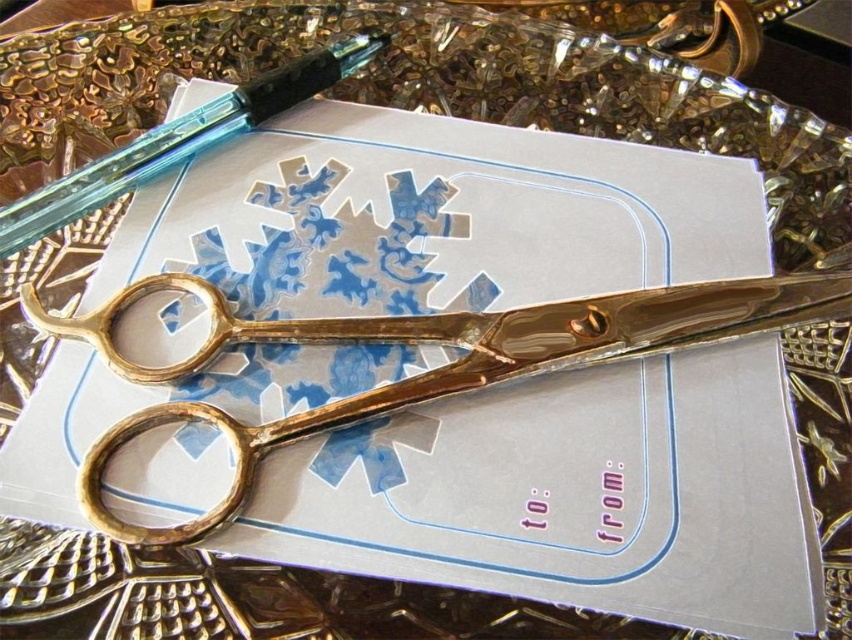
You are designing a display for a craft store and need to arrange the gold polished scissors at center and the translucent blue glass pen at upper left. The scissors are shorter than the pen. Which object should be placed lower to maintain visual balance?

The gold polished scissors at center should be placed lower than the translucent blue glass pen at upper left to balance their heights since the scissors are shorter than the pen.

You are an artist trying to place a new sticker between the gold polished scissors at center and the translucent blue glass pen at upper left. Can you fit it there if the sticker requires 3 inches of space?

The distance between the gold polished scissors at center and the translucent blue glass pen at upper left is 4.22 inches, so yes, you can fit a sticker that requires 3 inches of space between them.